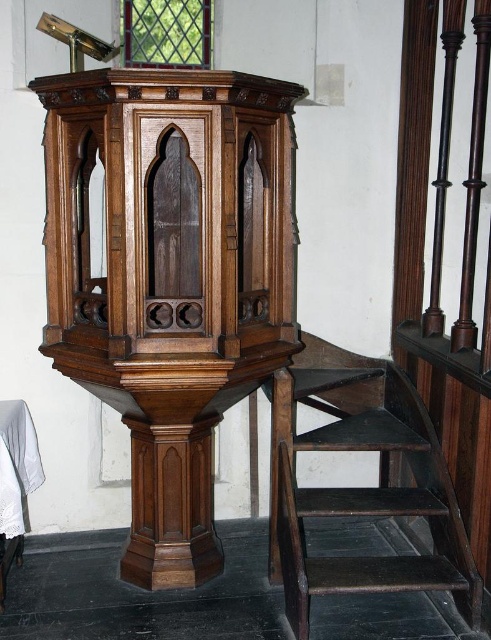
Question: Does polished wood pulpit at center have a lesser width compared to white cloth at lower left?

Choices:
 (A) no
 (B) yes

Answer: (A)

Question: Observing the image, what is the correct spatial positioning of dark brown wooden stairs at lower right in reference to white cloth at lower left?

Choices:
 (A) right
 (B) left

Answer: (A)

Question: Is dark brown wooden stairs at lower right bigger than white cloth at lower left?

Choices:
 (A) yes
 (B) no

Answer: (A)

Question: Considering the real-world distances, which object is closest to the dark brown wooden stairs at lower right?

Choices:
 (A) polished wood pulpit at center
 (B) white cloth at lower left

Answer: (A)

Question: Which object appears farthest from the camera in this image?

Choices:
 (A) white cloth at lower left
 (B) dark brown wooden stairs at lower right
 (C) polished wood pulpit at center

Answer: (A)

Question: Which point is closer to the camera?

Choices:
 (A) (2, 436)
 (B) (318, 449)
 (C) (117, 296)

Answer: (C)